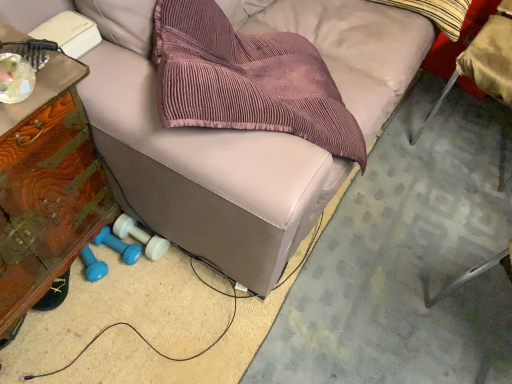
Question: Considering the relative sizes of leather couch at center, which is the second furniture from left to right, and metallic silver chair at lower right in the image provided, is leather couch at center, which is the second furniture from left to right, smaller than metallic silver chair at lower right?

Choices:
 (A) no
 (B) yes

Answer: (A)

Question: Is leather couch at center, arranged as the first furniture when viewed from the right, far from metallic silver chair at lower right?

Choices:
 (A) yes
 (B) no

Answer: (B)

Question: Can you confirm if leather couch at center, which is the second furniture from left to right, is taller than metallic silver chair at lower right?

Choices:
 (A) no
 (B) yes

Answer: (B)

Question: Does leather couch at center, which is the second furniture from left to right, turn towards metallic silver chair at lower right?

Choices:
 (A) yes
 (B) no

Answer: (A)

Question: From a real-world perspective, is leather couch at center, arranged as the first furniture when viewed from the right, physically below metallic silver chair at lower right?

Choices:
 (A) no
 (B) yes

Answer: (A)

Question: Is leather couch at center, arranged as the first furniture when viewed from the right, wider than metallic silver chair at lower right?

Choices:
 (A) yes
 (B) no

Answer: (A)

Question: From the image's perspective, is wooden side table at left, the first furniture in the left-to-right sequence, beneath blue rubber dumbbell at lower left, arranged as the 1th dumbbell when viewed from the right?

Choices:
 (A) yes
 (B) no

Answer: (B)

Question: Can you confirm if wooden side table at left, the second furniture positioned from the right, is wider than blue rubber dumbbell at lower left, arranged as the 1th dumbbell when viewed from the right?

Choices:
 (A) yes
 (B) no

Answer: (A)

Question: Can you see wooden side table at left, the first furniture in the left-to-right sequence, touching blue rubber dumbbell at lower left, arranged as the 1th dumbbell when viewed from the right?

Choices:
 (A) no
 (B) yes

Answer: (A)

Question: From a real-world perspective, is wooden side table at left, the second furniture positioned from the right, on top of blue rubber dumbbell at lower left, arranged as the 1th dumbbell when viewed from the right?

Choices:
 (A) no
 (B) yes

Answer: (B)

Question: Is blue rubber dumbbell at lower left, the 2th dumbbell in the left-to-right sequence, at the back of wooden side table at left, the first furniture in the left-to-right sequence?

Choices:
 (A) yes
 (B) no

Answer: (B)

Question: Would you say wooden side table at left, the second furniture positioned from the right, is outside blue rubber dumbbell at lower left, arranged as the 1th dumbbell when viewed from the right?

Choices:
 (A) yes
 (B) no

Answer: (A)

Question: Is blue rubber dumbbell at lower left, the 2th dumbbell in the left-to-right sequence, further to the viewer compared to striped cotton throw pillow at upper right?

Choices:
 (A) yes
 (B) no

Answer: (B)